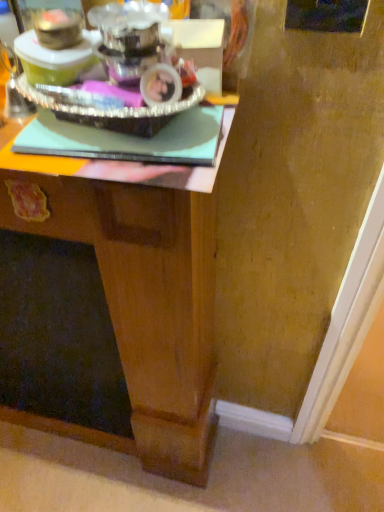
This screenshot has height=512, width=384. Describe the element at coordinates (110, 109) in the screenshot. I see `silver metallic tray at upper left` at that location.

The height and width of the screenshot is (512, 384). I want to click on silver metallic tray at upper left, so click(x=110, y=109).

The width and height of the screenshot is (384, 512). In order to click on wooden desk at center in this screenshot , I will do `click(143, 286)`.

This screenshot has height=512, width=384. What do you see at coordinates (143, 286) in the screenshot?
I see `wooden desk at center` at bounding box center [143, 286].

This screenshot has width=384, height=512. What are the coordinates of `silver metallic tray at upper left` in the screenshot? It's located at (110, 109).

Is wooden desk at center to the right of silver metallic tray at upper left from the viewer's perspective?

Incorrect, wooden desk at center is not on the right side of silver metallic tray at upper left.

Is wooden desk at center in front of or behind silver metallic tray at upper left in the image?

In the image, wooden desk at center appears behind silver metallic tray at upper left.

Does point (19, 173) appear closer or farther from the camera than point (164, 105)?

Clearly, point (19, 173) is more distant from the camera than point (164, 105).

From the image's perspective, is wooden desk at center located above silver metallic tray at upper left?

No, from the image's perspective, wooden desk at center is not above silver metallic tray at upper left.

From a real-world perspective, is wooden desk at center located beneath silver metallic tray at upper left?

Yes.

Looking at this image, between wooden desk at center and silver metallic tray at upper left, which one has smaller width?

Thinner between the two is silver metallic tray at upper left.

In terms of height, does wooden desk at center look taller or shorter compared to silver metallic tray at upper left?

wooden desk at center is taller than silver metallic tray at upper left.

In terms of size, does wooden desk at center appear bigger or smaller than silver metallic tray at upper left?

wooden desk at center is bigger than silver metallic tray at upper left.

Would you say wooden desk at center is inside or outside silver metallic tray at upper left?

wooden desk at center cannot be found inside silver metallic tray at upper left.

Would you consider wooden desk at center to be distant from silver metallic tray at upper left?

wooden desk at center is actually quite close to silver metallic tray at upper left.

Is wooden desk at center turned away from silver metallic tray at upper left?

No.

How many degrees apart are the facing directions of wooden desk at center and silver metallic tray at upper left?

They differ by 5.72 degrees in their facing directions.

Based on the photo, how far apart are wooden desk at center and silver metallic tray at upper left?

wooden desk at center is 14.16 inches from silver metallic tray at upper left.

Identify the location of desk below the silver metallic tray at upper left (from a real-world perspective). (143, 286).

Can you confirm if silver metallic tray at upper left is positioned to the left of wooden desk at center?

Incorrect, silver metallic tray at upper left is not on the left side of wooden desk at center.

Does silver metallic tray at upper left lie behind wooden desk at center?

No, it is not.

Which point is more forward, (39, 99) or (170, 351)?

The point (39, 99) is closer.

From the image's perspective, relative to wooden desk at center, is silver metallic tray at upper left above or below?

Clearly, from the image's perspective, silver metallic tray at upper left is above wooden desk at center.

From the picture: From a real-world perspective, which is physically above, silver metallic tray at upper left or wooden desk at center?

From a 3D spatial view, silver metallic tray at upper left is above.

Consider the image. Which of these two, silver metallic tray at upper left or wooden desk at center, is wider?

With larger width is wooden desk at center.

Is silver metallic tray at upper left taller than wooden desk at center?

In fact, silver metallic tray at upper left may be shorter than wooden desk at center.

Is silver metallic tray at upper left bigger or smaller than wooden desk at center?

Clearly, silver metallic tray at upper left is smaller in size than wooden desk at center.

Can wooden desk at center be found inside silver metallic tray at upper left?

No, wooden desk at center is not a part of silver metallic tray at upper left.

Are silver metallic tray at upper left and wooden desk at center far apart?

silver metallic tray at upper left is near wooden desk at center, not far away.

Is silver metallic tray at upper left looking in the opposite direction of wooden desk at center?

silver metallic tray at upper left is not turned away from wooden desk at center.

Based on the photo, can you tell me how much silver metallic tray at upper left and wooden desk at center differ in facing direction?

There is a 5.72-degree angle between the facing directions of silver metallic tray at upper left and wooden desk at center.

Where is `appliance on the right of the wooden desk at center`? This screenshot has width=384, height=512. appliance on the right of the wooden desk at center is located at coordinates (110, 109).

Where is `desk below the silver metallic tray at upper left (from a real-world perspective)`? desk below the silver metallic tray at upper left (from a real-world perspective) is located at coordinates (143, 286).

Find the location of `appliance on the right of wooden desk at center`. appliance on the right of wooden desk at center is located at coordinates (110, 109).